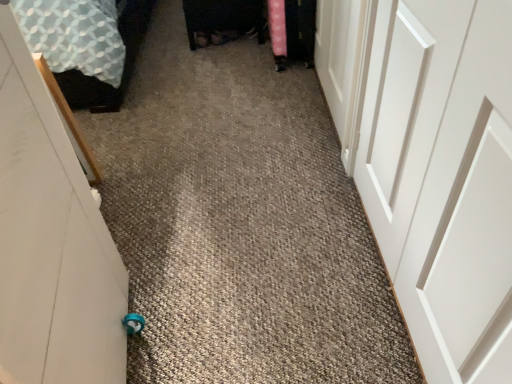
Question: Considering the relative sizes of white matte door at upper right, arranged as the 2th door when viewed from the left, and white matte door at left, placed as the first door when sorted from left to right, in the image provided, is white matte door at upper right, arranged as the 2th door when viewed from the left, taller than white matte door at left, placed as the first door when sorted from left to right,?

Choices:
 (A) no
 (B) yes

Answer: (A)

Question: Is white matte door at upper right, arranged as the 2th door when viewed from the left, at the left side of white matte door at left, marked as the 3th door in a right-to-left arrangement?

Choices:
 (A) no
 (B) yes

Answer: (A)

Question: Is white matte door at upper right, arranged as the 2th door when viewed from the left, to the right of white matte door at left, marked as the 3th door in a right-to-left arrangement, from the viewer's perspective?

Choices:
 (A) yes
 (B) no

Answer: (A)

Question: Considering the relative positions of white matte door at upper right, positioned as the 2th door in right-to-left order, and white matte door at left, placed as the first door when sorted from left to right, in the image provided, is white matte door at upper right, positioned as the 2th door in right-to-left order, behind white matte door at left, placed as the first door when sorted from left to right,?

Choices:
 (A) no
 (B) yes

Answer: (B)

Question: From a real-world perspective, is white matte door at upper right, positioned as the 2th door in right-to-left order, over white matte door at left, marked as the 3th door in a right-to-left arrangement?

Choices:
 (A) yes
 (B) no

Answer: (B)

Question: Looking at their shapes, would you say patterned fabric bed at left is wider or thinner than white matte door at left, marked as the 3th door in a right-to-left arrangement?

Choices:
 (A) wide
 (B) thin

Answer: (A)

Question: Considering their positions, is patterned fabric bed at left located in front of or behind white matte door at left, marked as the 3th door in a right-to-left arrangement?

Choices:
 (A) front
 (B) behind

Answer: (B)

Question: From their relative heights in the image, would you say patterned fabric bed at left is taller or shorter than white matte door at left, marked as the 3th door in a right-to-left arrangement?

Choices:
 (A) short
 (B) tall

Answer: (A)

Question: Considering the positions of patterned fabric bed at left and white matte door at left, placed as the first door when sorted from left to right, in the image, is patterned fabric bed at left bigger or smaller than white matte door at left, placed as the first door when sorted from left to right,?

Choices:
 (A) big
 (B) small

Answer: (A)

Question: Considering the positions of patterned fabric bed at left and white matte door at upper right, positioned as the 2th door in right-to-left order, in the image, is patterned fabric bed at left wider or thinner than white matte door at upper right, positioned as the 2th door in right-to-left order,?

Choices:
 (A) wide
 (B) thin

Answer: (A)

Question: In terms of size, does patterned fabric bed at left appear bigger or smaller than white matte door at upper right, arranged as the 2th door when viewed from the left?

Choices:
 (A) small
 (B) big

Answer: (B)

Question: Considering their positions, is patterned fabric bed at left located in front of or behind white matte door at upper right, arranged as the 2th door when viewed from the left?

Choices:
 (A) behind
 (B) front

Answer: (A)

Question: From a real-world perspective, is patterned fabric bed at left above or below white matte door at upper right, positioned as the 2th door in right-to-left order?

Choices:
 (A) above
 (B) below

Answer: (B)

Question: From a real-world perspective, is white smooth door at right, which is counted as the first door, starting from the right, physically located above or below white matte door at left, marked as the 3th door in a right-to-left arrangement?

Choices:
 (A) above
 (B) below

Answer: (B)

Question: From the image's perspective, relative to white matte door at left, marked as the 3th door in a right-to-left arrangement, is white smooth door at right, which is counted as the first door, starting from the right, above or below?

Choices:
 (A) below
 (B) above

Answer: (B)